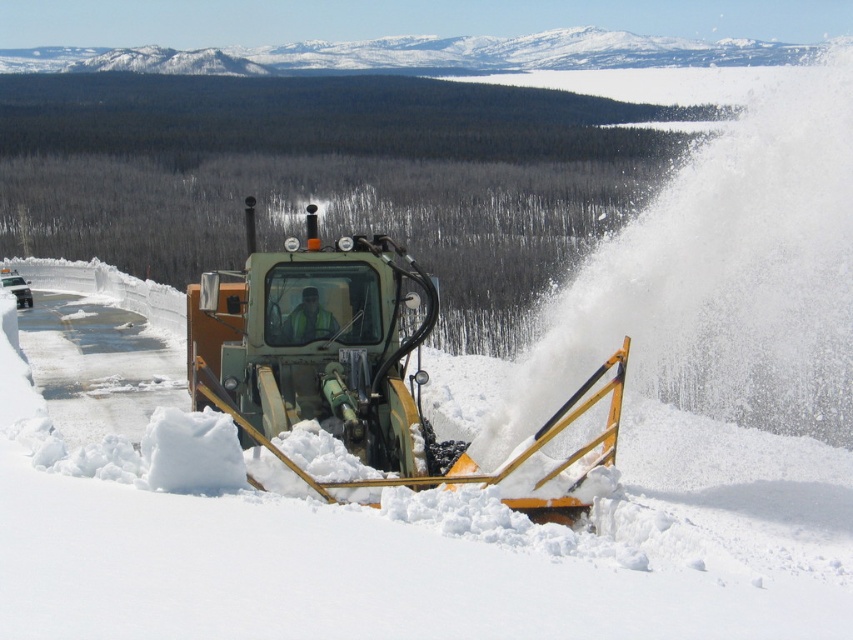
Question: In this image, where is yellow metallic snowplow at center located relative to reflective safety vest at center?

Choices:
 (A) left
 (B) right

Answer: (A)

Question: Estimate the real-world distances between objects in this image. Which object is closer to the green metallic snowplow at center?

Choices:
 (A) reflective safety vest at center
 (B) yellow metallic snowplow at center

Answer: (A)

Question: Does green metallic snowplow at center have a larger size compared to reflective safety vest at center?

Choices:
 (A) no
 (B) yes

Answer: (B)

Question: Estimate the real-world distances between objects in this image. Which object is closer to the reflective safety vest at center?

Choices:
 (A) yellow metallic snowplow at center
 (B) green metallic snowplow at center

Answer: (B)

Question: Which object appears closest to the camera in this image?

Choices:
 (A) green metallic snowplow at center
 (B) reflective safety vest at center

Answer: (A)

Question: Can you confirm if yellow metallic snowplow at center is bigger than reflective safety vest at center?

Choices:
 (A) no
 (B) yes

Answer: (B)